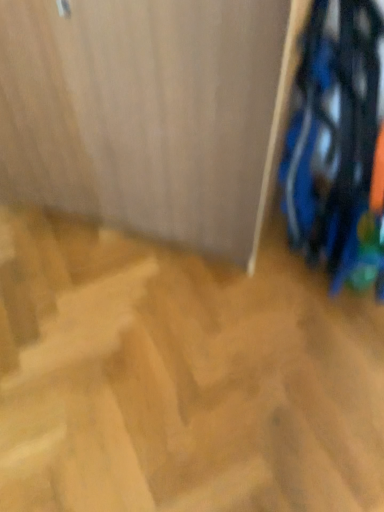
The width and height of the screenshot is (384, 512). In order to click on free space in front of blue fabric laundry at right in this screenshot , I will do `click(302, 331)`.